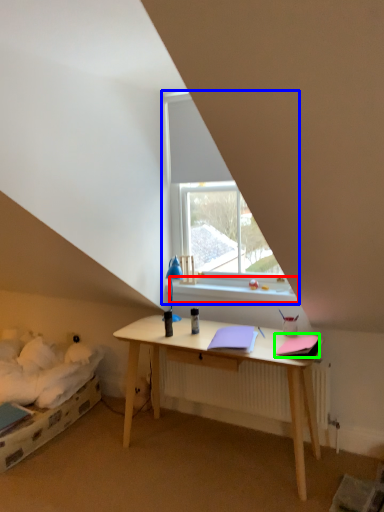
Question: Which object is the farthest from window sill (highlighted by a red box)? Choose among these: window (highlighted by a blue box) or notebook (highlighted by a green box).

Choices:
 (A) window
 (B) notebook

Answer: (B)